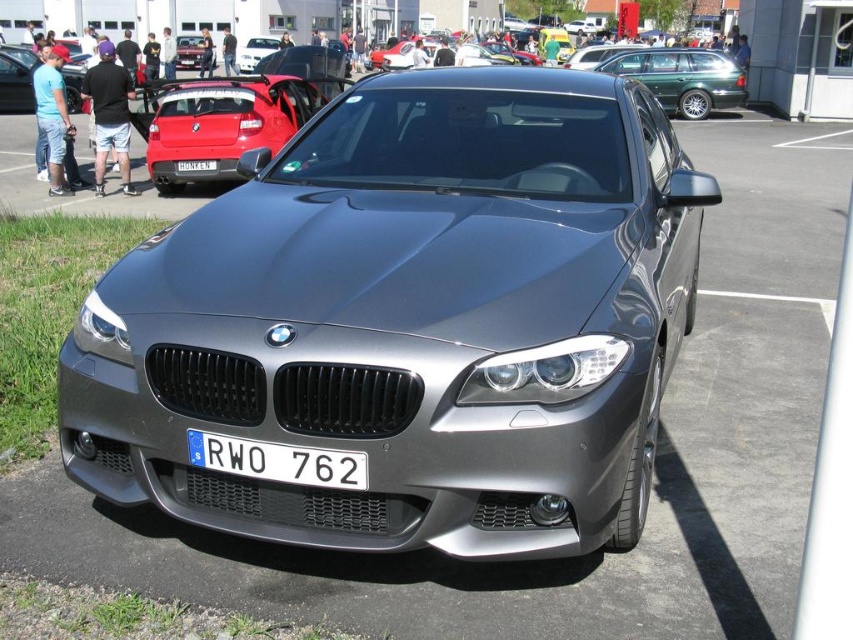
Can you confirm if matte black car at upper left is smaller than matte black car at upper center?

Yes, matte black car at upper left is smaller than matte black car at upper center.

Is point (30, 100) farther from viewer compared to point (250, 44)?

No, (30, 100) is closer to viewer.

Is point (74, 99) positioned after point (244, 51)?

No.

Locate an element on the screen. matte black car at upper left is located at coordinates (16, 80).

Can you confirm if metallic green wagon at upper right is smaller than metallic red car at center?

Correct, metallic green wagon at upper right occupies less space than metallic red car at center.

What do you see at coordinates (683, 77) in the screenshot?
I see `metallic green wagon at upper right` at bounding box center [683, 77].

At what (x,y) coordinates should I click in order to perform the action: click on metallic green wagon at upper right. Please return your answer as a coordinate pair (x, y). This screenshot has height=640, width=853. Looking at the image, I should click on (683, 77).

This screenshot has width=853, height=640. I want to click on metallic green wagon at upper right, so click(x=683, y=77).

Can you confirm if metallic green wagon at upper right is thinner than white plastic license plate at center?

In fact, metallic green wagon at upper right might be wider than white plastic license plate at center.

Measure the distance between point (675, 97) and camera.

Point (675, 97) is 20.63 meters from camera.

The height and width of the screenshot is (640, 853). Identify the location of metallic green wagon at upper right. 683,77.